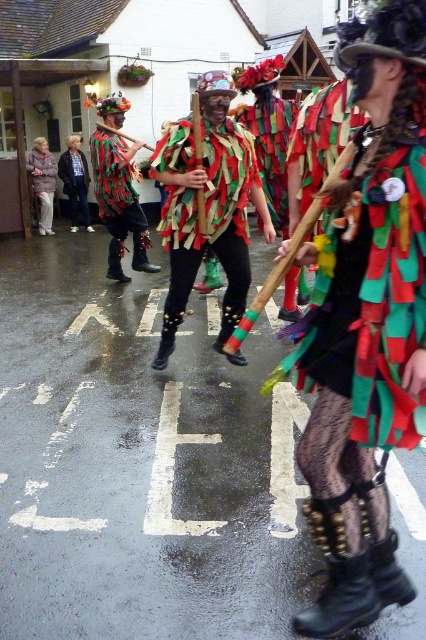
You are standing at the origin point of the coordinate system. You want to move towards the multicolored fabric strips at center. Which direction should you go?

The multicolored fabric strips at center are located at point (212,221), so you should move northeast to reach them.

You are standing on the wet street and want to take a photo of both the point at (x=359, y=433) and the point at (x=45, y=147). Which point should you focus on first to ensure both are in clear view?

You should focus on the point at (x=359, y=433) first because it is closer to the camera than the point at (x=45, y=147), ensuring both points are in focus when using depth of field.

You are a photographer standing on the wet street trying to capture both the textured fabric costume at center and the matte black pants at left in a single frame. Given that your camera has a maximum focus range of 10 meters, will you be able to focus on both subjects simultaneously?

The distance between the textured fabric costume at center and the matte black pants at left is 10.21 meters, which exceeds the camera maximum focus range of 10 meters. Therefore, you cannot focus on both subjects simultaneously.